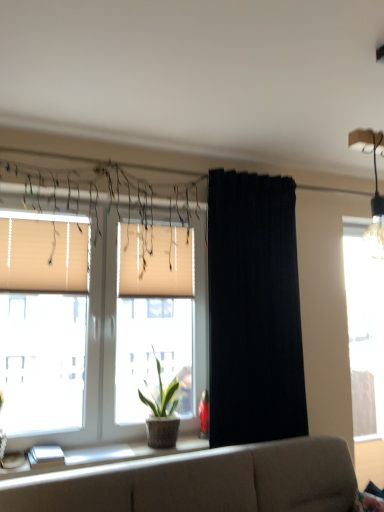
Consider the image. Measure the distance between point (x=23, y=223) and camera.

Point (x=23, y=223) and camera are 7.97 feet apart.

The height and width of the screenshot is (512, 384). Describe the element at coordinates (156, 262) in the screenshot. I see `white pleated blinds at center, acting as the second window blind starting from the front` at that location.

Where is `black fabric curtain at center`? black fabric curtain at center is located at coordinates click(x=254, y=310).

The image size is (384, 512). Describe the element at coordinates (162, 413) in the screenshot. I see `green leafy plant in woven pot at window` at that location.

The image size is (384, 512). What do you see at coordinates (365, 326) in the screenshot?
I see `transparent glass window at right, the first window positioned from the back` at bounding box center [365, 326].

This screenshot has height=512, width=384. Identify the location of beige fabric blinds at left, which is counted as the second window blind, starting from the right. (43, 254).

Is black fabric curtain at center oriented away from transparent glass window at right, the first window positioned from the back?

No.

Looking at their sizes, would you say black fabric curtain at center is wider or thinner than transparent glass window at right, the first window positioned from the back?

Clearly, black fabric curtain at center has more width compared to transparent glass window at right, the first window positioned from the back.

Measure the distance from black fabric curtain at center to transparent glass window at right, the first window positioned from the back.

The distance of black fabric curtain at center from transparent glass window at right, the first window positioned from the back, is 3.67 feet.

How different are the orientations of black fabric curtain at center and transparent glass window at right, the first window positioned from the back, in degrees?

0.723 degrees.

From the picture: Considering the positions of objects white glossy window sill at lower left and green leafy plant in woven pot at window in the image provided, who is more to the right, white glossy window sill at lower left or green leafy plant in woven pot at window?

From the viewer's perspective, green leafy plant in woven pot at window appears more on the right side.

Looking at this image, could you tell me if white glossy window sill at lower left is turned towards green leafy plant in woven pot at window?

No, white glossy window sill at lower left is not facing towards green leafy plant in woven pot at window.

From a real-world perspective, which object stands above the other?

green leafy plant in woven pot at window.

This screenshot has height=512, width=384. In order to click on window sill in front of the green leafy plant in woven pot at window in this screenshot , I will do `click(110, 455)`.

You are a GUI agent. You are given a task and a screenshot of the screen. Output one action in this format:
    pyautogui.click(x=<x>, y=<y>)
    Task: Click on the window on the left of the beige fabric couch at lower center
    
    Given the screenshot: What is the action you would take?
    click(96, 354)

Which object is wider, beige fabric couch at lower center or beige fabric window at center, the second window when ordered from right to left?

With larger width is beige fabric couch at lower center.

Which object is more forward, beige fabric couch at lower center or beige fabric window at center, the 1th window when ordered from front to back?

Positioned in front is beige fabric couch at lower center.

There is a transparent glass window at right, the second window viewed from the front. Where is `the 2nd window blind above it (from a real-world perspective)`? This screenshot has width=384, height=512. the 2nd window blind above it (from a real-world perspective) is located at coordinates (156, 262).

From the image's perspective, which one is positioned higher, transparent glass window at right, arranged as the 2th window when viewed from the left, or white pleated blinds at center, acting as the second window blind starting from the front?

white pleated blinds at center, acting as the second window blind starting from the front, from the image's perspective.

Does point (364, 361) appear closer or farther from the camera than point (190, 249)?

Point (364, 361).

Is transparent glass window at right, the first window positioned from the back, oriented away from white pleated blinds at center, the first window blind viewed from the back?

That's not correct — transparent glass window at right, the first window positioned from the back, is not looking away from white pleated blinds at center, the first window blind viewed from the back.

Is white glossy window sill at lower left next to beige fabric couch at lower center?

No, white glossy window sill at lower left is not next to beige fabric couch at lower center.

Considering the relative sizes of white glossy window sill at lower left and beige fabric couch at lower center in the image provided, is white glossy window sill at lower left bigger than beige fabric couch at lower center?

No.

Would you say white glossy window sill at lower left is outside beige fabric couch at lower center?

Absolutely, white glossy window sill at lower left is external to beige fabric couch at lower center.

Is white glossy window sill at lower left turned away from beige fabric couch at lower center?

No, beige fabric couch at lower center is not at the back of white glossy window sill at lower left.

Is the position of black fabric curtain at center less distant than that of beige fabric blinds at left, marked as the first window blind in a left-to-right arrangement?

Yes, it is.

From the image's perspective, is black fabric curtain at center located above or below beige fabric blinds at left, the first window blind positioned from the front?

Clearly, from the image's perspective, black fabric curtain at center is below beige fabric blinds at left, the first window blind positioned from the front.

Which of these two, black fabric curtain at center or beige fabric blinds at left, which is counted as the second window blind, starting from the right, stands taller?

With more height is black fabric curtain at center.

Considering the relative positions of black fabric curtain at center and beige fabric blinds at left, which is counted as the 2th window blind, starting from the back, in the image provided, is black fabric curtain at center to the left or to the right of beige fabric blinds at left, which is counted as the 2th window blind, starting from the back,?

black fabric curtain at center is positioned on beige fabric blinds at left, which is counted as the 2th window blind, starting from the back,'s right side.

Can you see transparent glass window at right, arranged as the 2th window when viewed from the left, touching beige fabric couch at lower center?

No, transparent glass window at right, arranged as the 2th window when viewed from the left, is not beside beige fabric couch at lower center.

From a real-world perspective, relative to beige fabric couch at lower center, is transparent glass window at right, the first window positioned from the back, vertically above or below?

In terms of real-world spatial position, transparent glass window at right, the first window positioned from the back, is above beige fabric couch at lower center.

At what (x,y) coordinates should I click in order to perform the action: click on curtain that appears above the transparent glass window at right, the second window viewed from the front (from the image's perspective). Please return your answer as a coordinate pair (x, y). Image resolution: width=384 pixels, height=512 pixels. Looking at the image, I should click on (254, 310).

At what (x,y) coordinates should I click in order to perform the action: click on window sill located in front of the green leafy plant in woven pot at window. Please return your answer as a coordinate pair (x, y). Looking at the image, I should click on (110, 455).

When comparing their distances from white pleated blinds at center, acting as the second window blind starting from the front, does black fabric curtain at center or beige fabric blinds at left, marked as the first window blind in a left-to-right arrangement, seem further?

black fabric curtain at center.

From the image, which object appears to be nearer to beige fabric blinds at left, which is counted as the 2th window blind, starting from the back, transparent glass window at right, which is the first window in right-to-left order, or beige fabric window at center, the first window viewed from the left?

beige fabric window at center, the first window viewed from the left, is positioned closer to the anchor beige fabric blinds at left, which is counted as the 2th window blind, starting from the back.

Looking at the image, which one is located further to white glossy window sill at lower left, beige fabric window at center, the 1th window when ordered from front to back, or beige fabric blinds at left, which is counted as the second window blind, starting from the right?

The object further to white glossy window sill at lower left is beige fabric blinds at left, which is counted as the second window blind, starting from the right.

Looking at the image, which one is located further to beige fabric window at center, the first window viewed from the left, black fabric curtain at center or beige fabric blinds at left, which is counted as the second window blind, starting from the right?

Based on the image, black fabric curtain at center appears to be further to beige fabric window at center, the first window viewed from the left.

Considering their positions, is beige fabric couch at lower center positioned closer to white glossy window sill at lower left than black fabric curtain at center?

Among the two, beige fabric couch at lower center is located nearer to white glossy window sill at lower left.

Considering their positions, is white glossy window sill at lower left positioned further to green leafy plant in woven pot at window than beige fabric couch at lower center?

The object further to green leafy plant in woven pot at window is beige fabric couch at lower center.

From the picture: Considering their positions, is green leafy plant in woven pot at window positioned further to beige fabric window at center, the first window viewed from the left, than white pleated blinds at center, the first window blind viewed from the back?

The object further to beige fabric window at center, the first window viewed from the left, is green leafy plant in woven pot at window.

Looking at the image, which one is located closer to beige fabric window at center, the first window viewed from the left, beige fabric couch at lower center or green leafy plant in woven pot at window?

Based on the image, green leafy plant in woven pot at window appears to be nearer to beige fabric window at center, the first window viewed from the left.

You are a GUI agent. You are given a task and a screenshot of the screen. Output one action in this format:
    pyautogui.click(x=<x>, y=<y>)
    Task: Click on the curtain situated between white pleated blinds at center, the 2th window blind viewed from the left, and transparent glass window at right, the first window positioned from the back, from left to right
    Image resolution: width=384 pixels, height=512 pixels.
    Given the screenshot: What is the action you would take?
    pyautogui.click(x=254, y=310)

This screenshot has height=512, width=384. I want to click on window blind situated between beige fabric window at center, the second window when ordered from right to left, and transparent glass window at right, arranged as the 2th window when viewed from the left, from left to right, so click(x=156, y=262).

The height and width of the screenshot is (512, 384). I want to click on window between beige fabric couch at lower center and transparent glass window at right, the first window positioned from the back, from front to back, so click(96, 354).

At what (x,y) coordinates should I click in order to perform the action: click on window situated between beige fabric blinds at left, which is counted as the 2th window blind, starting from the back, and white pleated blinds at center, acting as the second window blind starting from the front, from left to right. Please return your answer as a coordinate pair (x, y). The height and width of the screenshot is (512, 384). Looking at the image, I should click on (96, 354).